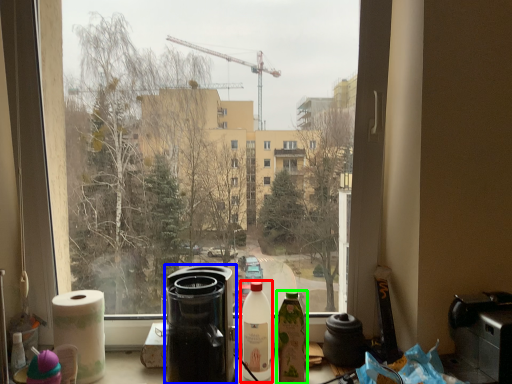
Question: Considering the real-world distances, which object is farthest from bottle (highlighted by a red box)? appliance (highlighted by a blue box) or bottle (highlighted by a green box)?

Choices:
 (A) appliance
 (B) bottle

Answer: (A)